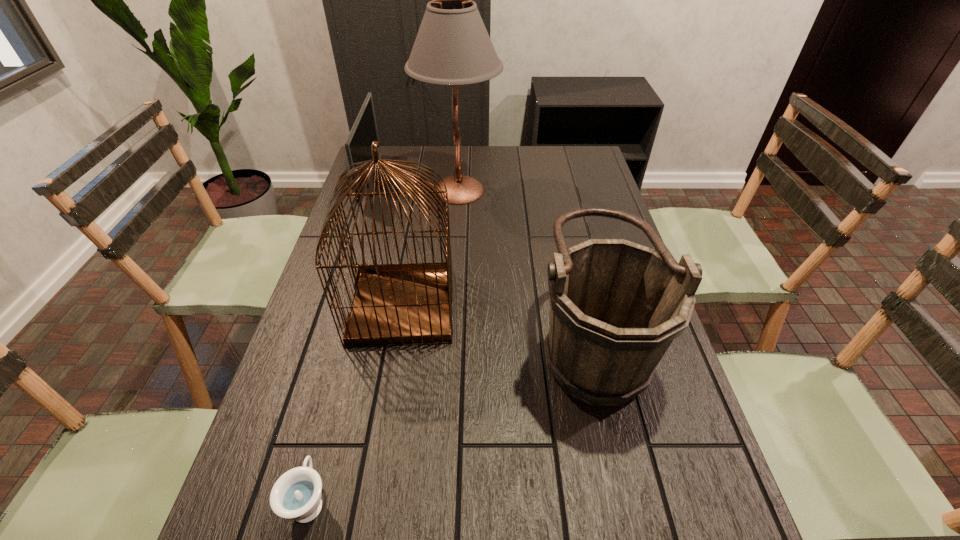
Where is `free location located 0.210m on the handle side of the rightmost object`? This screenshot has width=960, height=540. free location located 0.210m on the handle side of the rightmost object is located at coordinates click(x=448, y=341).

Where is `free space located 0.370m on the handle side of the rightmost object`? This screenshot has height=540, width=960. free space located 0.370m on the handle side of the rightmost object is located at coordinates (384, 341).

Where is `free space located on the handle side of the rightmost object`? The width and height of the screenshot is (960, 540). free space located on the handle side of the rightmost object is located at coordinates (400, 341).

Identify the location of vacant area situated 0.240m on the screen side of the leftmost object. This screenshot has height=540, width=960. (443, 181).

I want to click on vacant space located 0.220m on the side of the teacup with the handle, so click(343, 375).

Image resolution: width=960 pixels, height=540 pixels. Identify the location of vacant space situated on the side of the teacup with the handle. (349, 347).

This screenshot has width=960, height=540. Identify the location of free space located on the side of the teacup with the handle. (340, 386).

Where is `table lamp that is at the far edge`? The width and height of the screenshot is (960, 540). table lamp that is at the far edge is located at coordinates click(452, 47).

In order to click on monitor that is positioned at the far edge in this screenshot , I will do `click(364, 131)`.

Identify the location of birdcage present at the left edge. This screenshot has height=540, width=960. (395, 304).